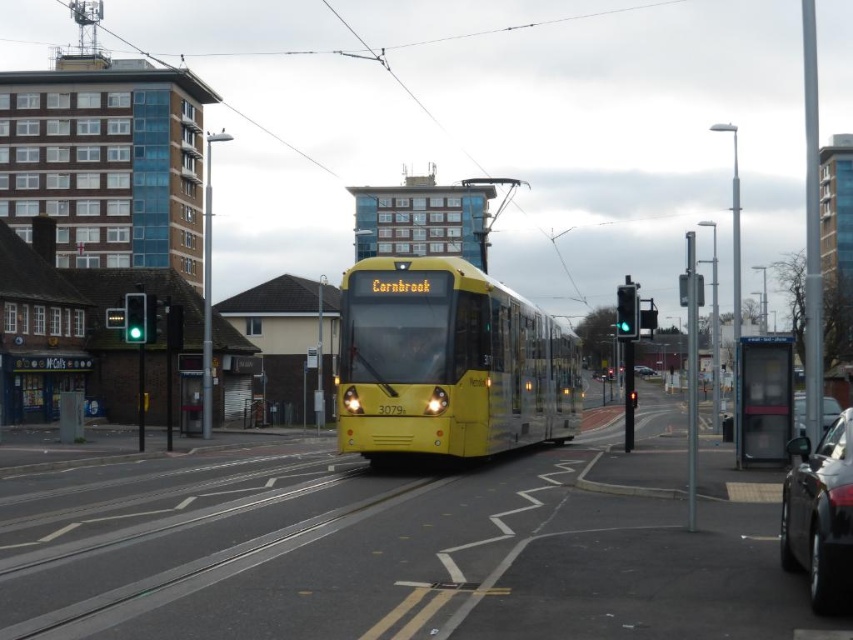
You are a pedestrian standing at the tram stop. You see a shiny black car at lower right and a metallic silver car at center. Which car is closer to your left side?

The shiny black car at lower right is to the left of the metallic silver car at center, so it is closer to your left side.

You are standing at the center of the tram track and want to find the shiny black car at lower right. In which direction should you look to see it?

The shiny black car at lower right is located at coordinates point (820, 515), so you should look to your lower right direction to see it.

You are a pedestrian standing at the crosswalk near the tram tracks. You need to cross the street to reach the tram stop. There are two cars blocking your path. One is the shiny black car at lower right and the other is the metallic silver car at center. Which car is closer to the tram tracks so you can walk around it safely?

The metallic silver car at center is closer to the tram tracks because the shiny black car at lower right is positioned over it, meaning the silver car is underneath and therefore closer to the tracks.